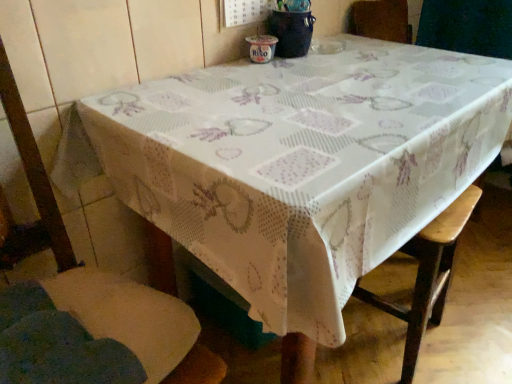
This screenshot has width=512, height=384. I want to click on vacant area to the right of wooden bar stool at lower right, so click(x=470, y=332).